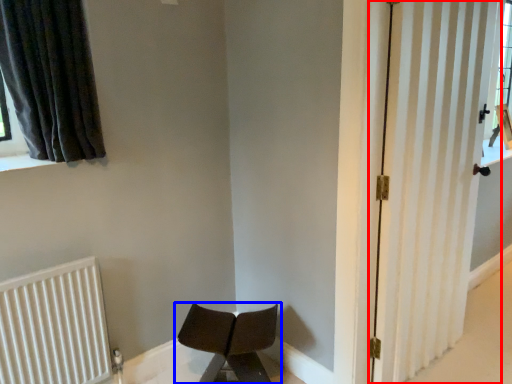
Question: Which of the following is the farthest to the observer, door (highlighted by a red box) or chair (highlighted by a blue box)?

Choices:
 (A) door
 (B) chair

Answer: (B)